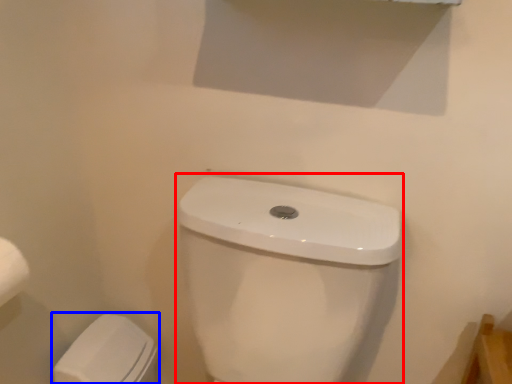
Question: Among these objects, which one is farthest to the camera, sink (highlighted by a red box) or porcelain (highlighted by a blue box)?

Choices:
 (A) sink
 (B) porcelain

Answer: (B)